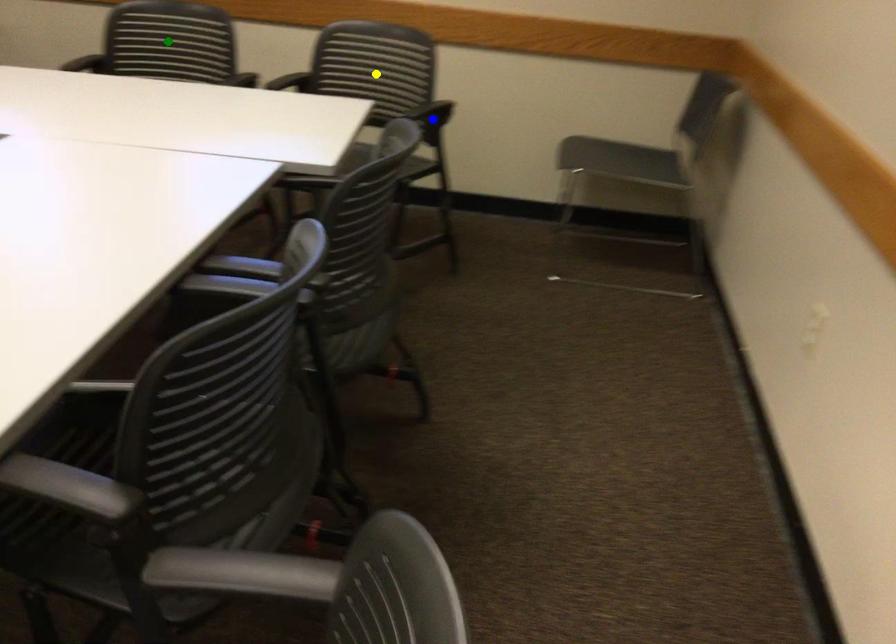
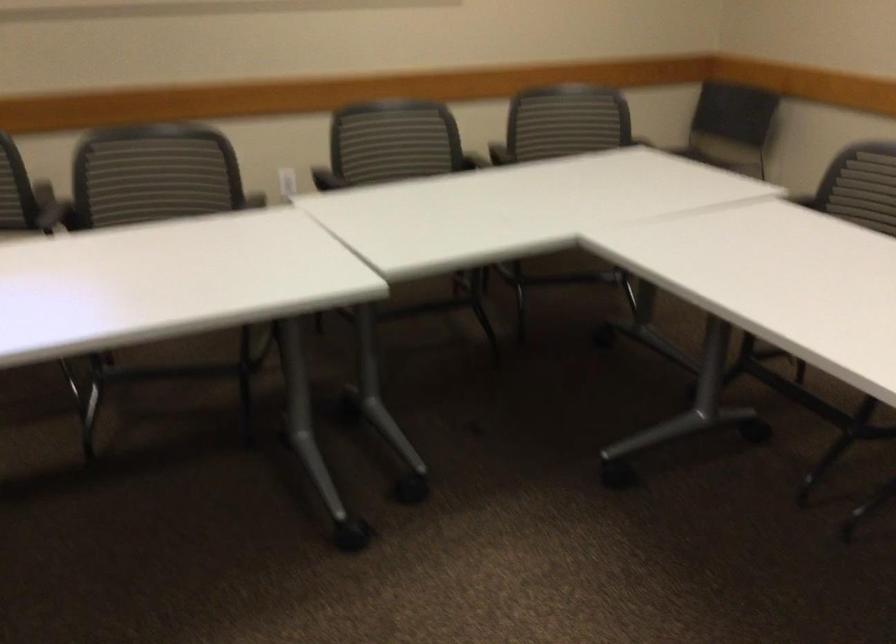
I am providing you with two images of the same scene from different viewpoints. Three points are marked in image1. Which point corresponds to a part or object that is occluded in image2?In image1, three points are marked. Which of them correspond to a part or object that is occluded in image2?Among the three points shown in image1, which one corresponds to a part or object that is no longer visible due to occlusion in image2?

green point, blue point, yellow point